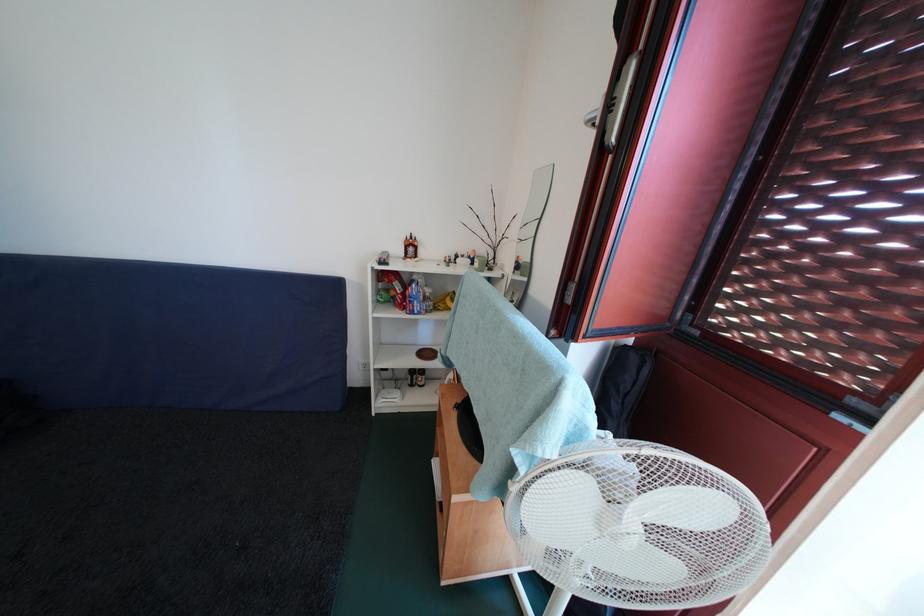
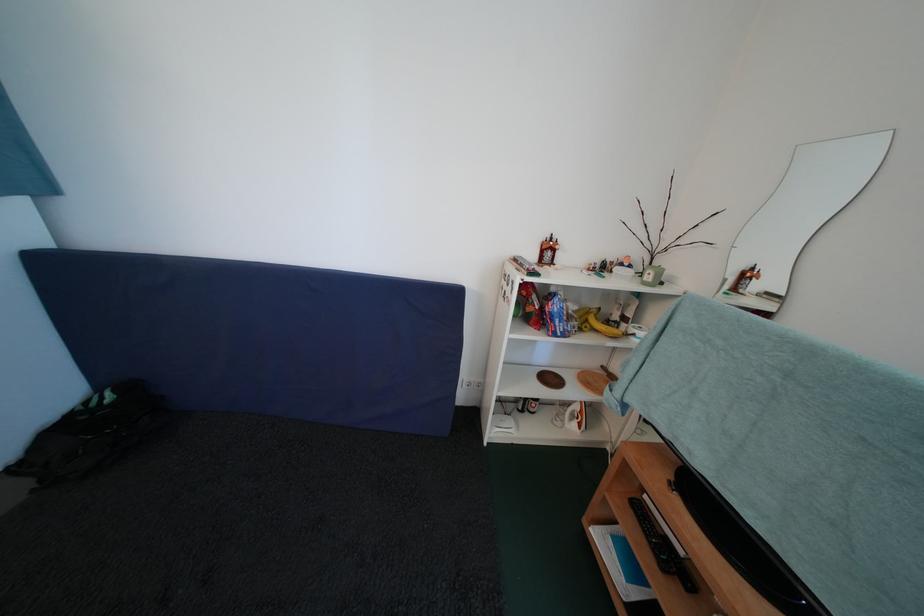
The point at (435,296) is marked in the first image. Where is the corresponding point in the second image?

(579, 313)